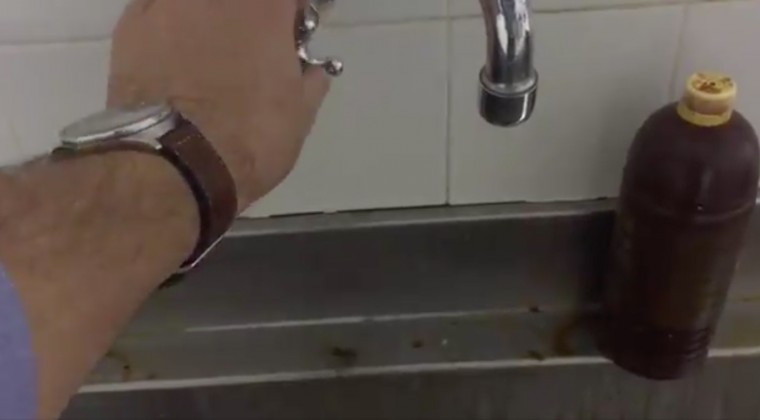
Where is `faucet`? The image size is (760, 420). faucet is located at coordinates (518, 66).